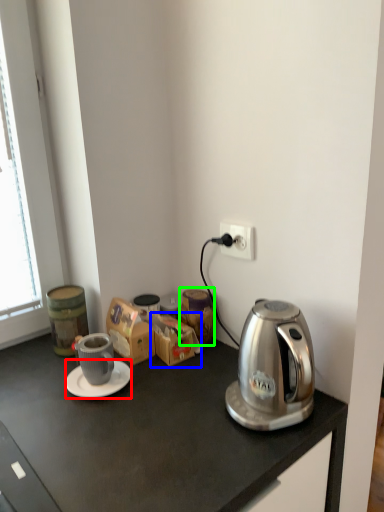
Question: Estimate the real-world distances between objects in this image. Which object is closer to saucer (highlighted by a red box), cardboard box (highlighted by a blue box) or appliance (highlighted by a green box)?

Choices:
 (A) cardboard box
 (B) appliance

Answer: (A)